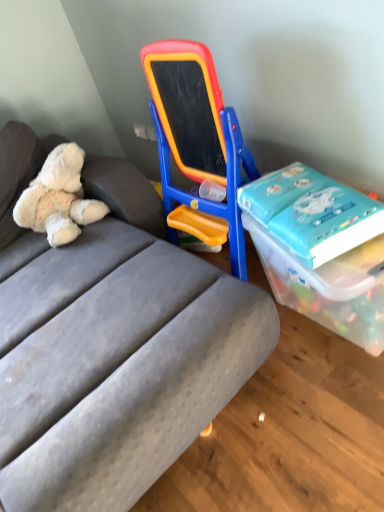
This screenshot has height=512, width=384. What are the coordinates of `free location to the left of transparent plastic box at right` in the screenshot? It's located at (262, 413).